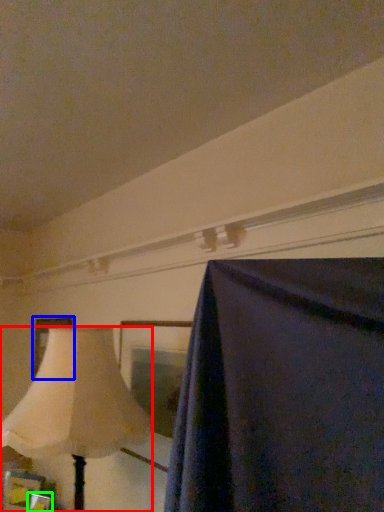
Question: Considering the real-world distances, which object is farthest from lamp (highlighted by a red box)? picture frame (highlighted by a blue box) or picture frame (highlighted by a green box)?

Choices:
 (A) picture frame
 (B) picture frame

Answer: (B)